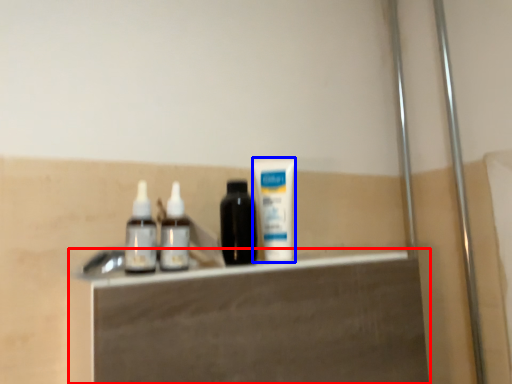
Question: Among these objects, which one is nearest to the camera, vanity (highlighted by a red box) or toothpaste (highlighted by a blue box)?

Choices:
 (A) vanity
 (B) toothpaste

Answer: (A)